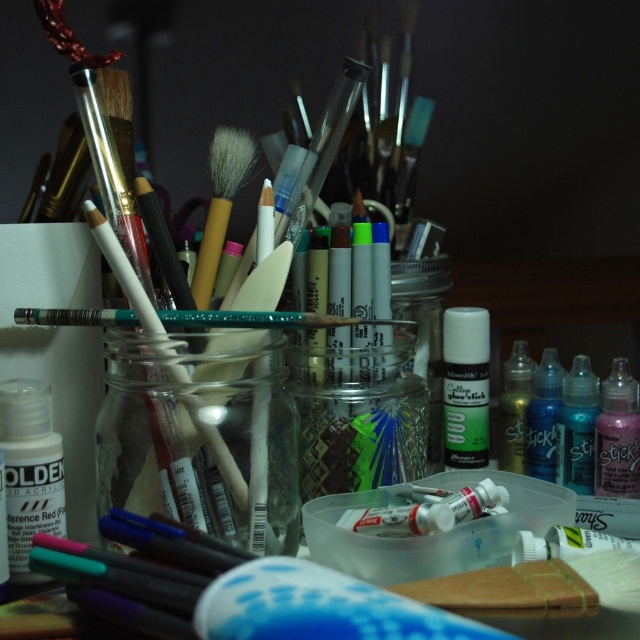
Question: Which object is closer to the camera taking this photo?

Choices:
 (A) pink glittery bottle at right
 (B) translucent blue liquid at lower right
 (C) translucent plastic bottle at lower left
 (D) transparent glass jar at center

Answer: (C)

Question: Can you confirm if pink glittery bottle at right is positioned below white matte paint brush at center?

Choices:
 (A) yes
 (B) no

Answer: (A)

Question: Which object is farther from the camera taking this photo?

Choices:
 (A) translucent plastic bottle at lower left
 (B) transparent glass jar at center
 (C) blue glossy bottle at center right

Answer: (C)

Question: Is clear glass jar at center to the right of white matte glue stick at center right from the viewer's perspective?

Choices:
 (A) yes
 (B) no

Answer: (B)

Question: Is transparent glass jar at center smaller than translucent blue liquid at lower right?

Choices:
 (A) yes
 (B) no

Answer: (B)

Question: Which point appears farthest from the camera in this image?

Choices:
 (A) (196, 484)
 (B) (339, 416)

Answer: (B)